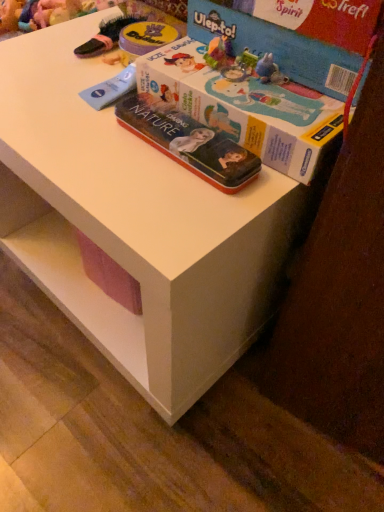
Question: Does cardboard box at upper right, placed as the 2th box when sorted from bottom to top, appear on the left side of blue cardboard box at upper right, which is counted as the 2th box, starting from the top?

Choices:
 (A) yes
 (B) no

Answer: (B)

Question: Is cardboard box at upper right, the first box viewed from the top, wider than blue cardboard box at upper right, which is counted as the 2th box, starting from the top?

Choices:
 (A) no
 (B) yes

Answer: (A)

Question: Does cardboard box at upper right, placed as the 2th box when sorted from bottom to top, lie behind blue cardboard box at upper right, marked as the first box in a bottom-to-top arrangement?

Choices:
 (A) no
 (B) yes

Answer: (B)

Question: From a real-world perspective, is cardboard box at upper right, the first box viewed from the top, below blue cardboard box at upper right, which is counted as the 2th box, starting from the top?

Choices:
 (A) yes
 (B) no

Answer: (B)

Question: Would you say cardboard box at upper right, the first box viewed from the top, is outside blue cardboard box at upper right, which is counted as the 2th box, starting from the top?

Choices:
 (A) yes
 (B) no

Answer: (A)

Question: Looking at their shapes, would you say cardboard box at upper right, placed as the 2th box when sorted from bottom to top, is wider or thinner than blue cardboard box at upper right, marked as the first box in a bottom-to-top arrangement?

Choices:
 (A) thin
 (B) wide

Answer: (A)

Question: Choose the correct answer: Is cardboard box at upper right, the first box viewed from the top, inside blue cardboard box at upper right, which is counted as the 2th box, starting from the top, or outside it?

Choices:
 (A) inside
 (B) outside

Answer: (B)

Question: In the image, is cardboard box at upper right, placed as the 2th box when sorted from bottom to top, on the left side or the right side of blue cardboard box at upper right, marked as the first box in a bottom-to-top arrangement?

Choices:
 (A) left
 (B) right

Answer: (B)

Question: From a real-world perspective, relative to blue cardboard box at upper right, which is counted as the 2th box, starting from the top, is cardboard box at upper right, the first box viewed from the top, vertically above or below?

Choices:
 (A) above
 (B) below

Answer: (A)

Question: From the image's perspective, is metallic tin box at center positioned above or below cardboard box at upper right, placed as the 2th box when sorted from bottom to top?

Choices:
 (A) above
 (B) below

Answer: (B)

Question: Based on their positions, is metallic tin box at center located to the left or right of cardboard box at upper right, placed as the 2th box when sorted from bottom to top?

Choices:
 (A) right
 (B) left

Answer: (B)

Question: Considering the positions of metallic tin box at center and cardboard box at upper right, the first box viewed from the top, in the image, is metallic tin box at center taller or shorter than cardboard box at upper right, the first box viewed from the top,?

Choices:
 (A) short
 (B) tall

Answer: (A)

Question: In terms of width, does metallic tin box at center look wider or thinner when compared to cardboard box at upper right, placed as the 2th box when sorted from bottom to top?

Choices:
 (A) wide
 (B) thin

Answer: (B)

Question: From a real-world perspective, is cardboard box at upper right, placed as the 2th box when sorted from bottom to top, physically located above or below metallic tin box at center?

Choices:
 (A) below
 (B) above

Answer: (B)

Question: In the image, is cardboard box at upper right, placed as the 2th box when sorted from bottom to top, on the left side or the right side of metallic tin box at center?

Choices:
 (A) left
 (B) right

Answer: (B)